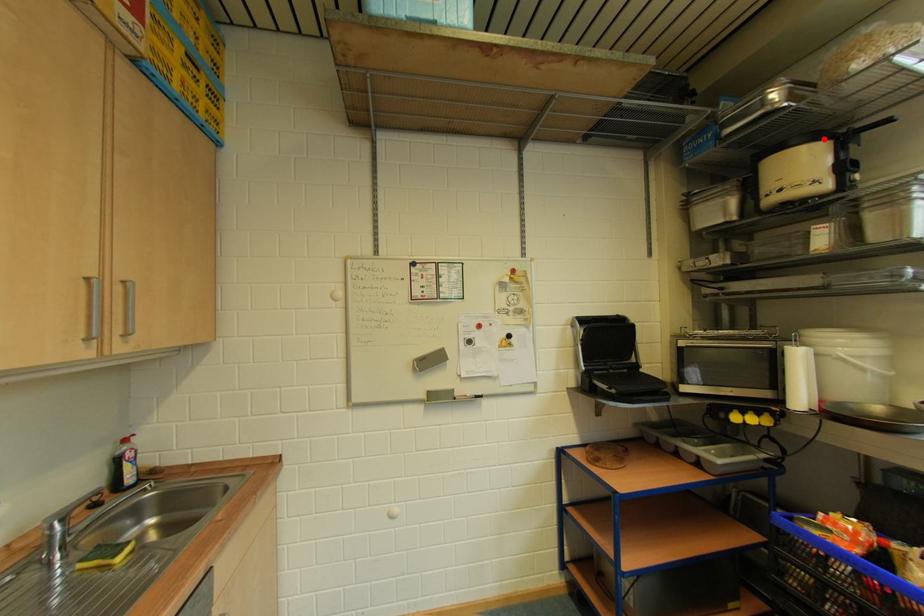
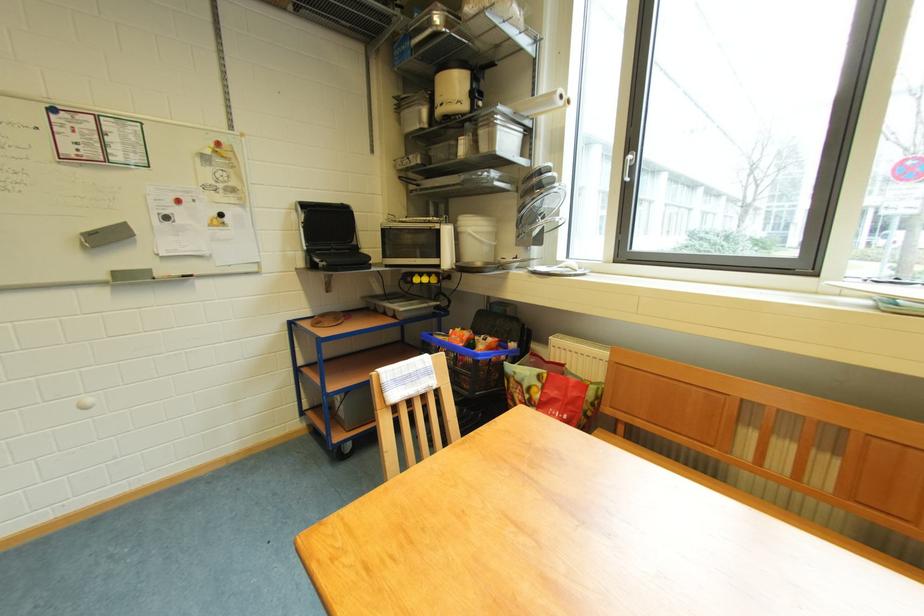
The point at the highlighted location is marked in the first image. Where is the corresponding point in the second image?

(469, 68)